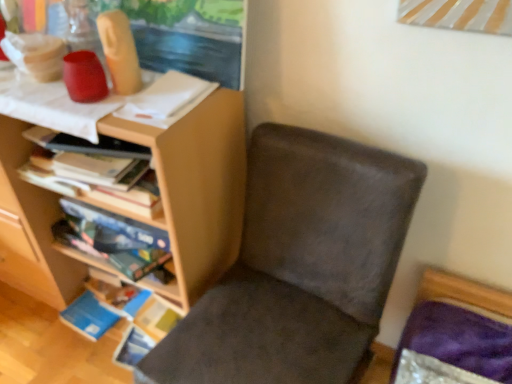
The image size is (512, 384). What do you see at coordinates (133, 211) in the screenshot?
I see `matte wood shelf at upper left, which is counted as the second shelf, starting from the bottom` at bounding box center [133, 211].

What is the approximate width of suede-like brown chair at center?

21.04 inches.

The height and width of the screenshot is (384, 512). I want to click on wooden bookshelf at left, which ranks as the 2th shelf in top-to-bottom order, so [31, 228].

Choose the correct answer: Is matte wood shelf at upper left, which ranks as the first shelf in top-to-bottom order, inside wooden bookshelf at left, the first shelf from the bottom, or outside it?

matte wood shelf at upper left, which ranks as the first shelf in top-to-bottom order, is outside wooden bookshelf at left, the first shelf from the bottom.

Based on the photo, is matte wood shelf at upper left, which is counted as the second shelf, starting from the bottom, far away from wooden bookshelf at left, which ranks as the 2th shelf in top-to-bottom order?

matte wood shelf at upper left, which is counted as the second shelf, starting from the bottom, is near wooden bookshelf at left, which ranks as the 2th shelf in top-to-bottom order, not far away.

From their relative heights in the image, would you say matte wood shelf at upper left, which is counted as the second shelf, starting from the bottom, is taller or shorter than wooden bookshelf at left, the first shelf from the bottom?

matte wood shelf at upper left, which is counted as the second shelf, starting from the bottom, is taller than wooden bookshelf at left, the first shelf from the bottom.

Which of these two, suede-like brown chair at center or wooden bookshelf at left, the first shelf from the bottom, is smaller?

Smaller between the two is wooden bookshelf at left, the first shelf from the bottom.

Is suede-like brown chair at center positioned with its back to wooden bookshelf at left, which ranks as the 2th shelf in top-to-bottom order?

No, suede-like brown chair at center is not facing the opposite direction of wooden bookshelf at left, which ranks as the 2th shelf in top-to-bottom order.

In the image, is suede-like brown chair at center on the left side or the right side of wooden bookshelf at left, which ranks as the 2th shelf in top-to-bottom order?

From the image, it's evident that suede-like brown chair at center is to the right of wooden bookshelf at left, which ranks as the 2th shelf in top-to-bottom order.

What's the angular difference between suede-like brown chair at center and wooden bookshelf at left, the first shelf from the bottom,'s facing directions?

The facing directions of suede-like brown chair at center and wooden bookshelf at left, the first shelf from the bottom, are 4.4 degrees apart.

From the image's perspective, who appears lower, suede-like brown chair at center or matte wood shelf at upper left, which ranks as the first shelf in top-to-bottom order?

suede-like brown chair at center is shown below in the image.

Does suede-like brown chair at center have a larger size compared to matte wood shelf at upper left, which ranks as the first shelf in top-to-bottom order?

Actually, suede-like brown chair at center might be smaller than matte wood shelf at upper left, which ranks as the first shelf in top-to-bottom order.

Between suede-like brown chair at center and matte wood shelf at upper left, which ranks as the first shelf in top-to-bottom order, which one appears on the left side from the viewer's perspective?

matte wood shelf at upper left, which ranks as the first shelf in top-to-bottom order.

What's the angular difference between wooden bookshelf at left, which ranks as the 2th shelf in top-to-bottom order, and suede-like brown chair at center's facing directions?

The angular difference between wooden bookshelf at left, which ranks as the 2th shelf in top-to-bottom order, and suede-like brown chair at center is 4.4 degrees.

Considering the positions of points (16, 179) and (174, 335), is point (16, 179) farther from camera compared to point (174, 335)?

That is True.

This screenshot has width=512, height=384. Find the location of `the 1st shelf to the left of the suede-like brown chair at center, starting your count from the anchor`. the 1st shelf to the left of the suede-like brown chair at center, starting your count from the anchor is located at coordinates (31, 228).

Would you consider wooden bookshelf at left, the first shelf from the bottom, to be distant from suede-like brown chair at center?

wooden bookshelf at left, the first shelf from the bottom, is actually quite close to suede-like brown chair at center.

Is the depth of matte wood shelf at upper left, which is counted as the second shelf, starting from the bottom, less than that of suede-like brown chair at center?

No, matte wood shelf at upper left, which is counted as the second shelf, starting from the bottom, is behind suede-like brown chair at center.

Is matte wood shelf at upper left, which ranks as the first shelf in top-to-bottom order, facing towards suede-like brown chair at center?

No, matte wood shelf at upper left, which ranks as the first shelf in top-to-bottom order, is not aimed at suede-like brown chair at center.

Looking at this image, which of these two, matte wood shelf at upper left, which ranks as the first shelf in top-to-bottom order, or suede-like brown chair at center, is smaller?

suede-like brown chair at center.

Visually, is wooden bookshelf at left, the first shelf from the bottom, positioned to the left or to the right of matte wood shelf at upper left, which is counted as the second shelf, starting from the bottom?

wooden bookshelf at left, the first shelf from the bottom, is to the right of matte wood shelf at upper left, which is counted as the second shelf, starting from the bottom.

Measure the distance from wooden bookshelf at left, the first shelf from the bottom, to matte wood shelf at upper left, which ranks as the first shelf in top-to-bottom order.

wooden bookshelf at left, the first shelf from the bottom, is 6.46 inches from matte wood shelf at upper left, which ranks as the first shelf in top-to-bottom order.

Does wooden bookshelf at left, which ranks as the 2th shelf in top-to-bottom order, touch matte wood shelf at upper left, which is counted as the second shelf, starting from the bottom?

No, wooden bookshelf at left, which ranks as the 2th shelf in top-to-bottom order, is not with matte wood shelf at upper left, which is counted as the second shelf, starting from the bottom.

Does wooden bookshelf at left, which ranks as the 2th shelf in top-to-bottom order, come in front of matte wood shelf at upper left, which ranks as the first shelf in top-to-bottom order?

No, it is behind matte wood shelf at upper left, which ranks as the first shelf in top-to-bottom order.

Locate an element on the screen. The width and height of the screenshot is (512, 384). shelf above the wooden bookshelf at left, which ranks as the 2th shelf in top-to-bottom order (from the image's perspective) is located at coordinates (133, 211).

Identify the location of chair that is on the right side of wooden bookshelf at left, the first shelf from the bottom. This screenshot has width=512, height=384. (298, 266).

Which object lies nearer to the anchor point suede-like brown chair at center, wooden bookshelf at left, the first shelf from the bottom, or matte wood shelf at upper left, which is counted as the second shelf, starting from the bottom?

matte wood shelf at upper left, which is counted as the second shelf, starting from the bottom, lies closer to suede-like brown chair at center than the other object.

Considering their positions, is matte wood shelf at upper left, which is counted as the second shelf, starting from the bottom, positioned further to wooden bookshelf at left, the first shelf from the bottom, than suede-like brown chair at center?

suede-like brown chair at center is positioned further to the anchor wooden bookshelf at left, the first shelf from the bottom.

When comparing their distances from wooden bookshelf at left, which ranks as the 2th shelf in top-to-bottom order, does suede-like brown chair at center or matte wood shelf at upper left, which is counted as the second shelf, starting from the bottom, seem closer?

Among the two, matte wood shelf at upper left, which is counted as the second shelf, starting from the bottom, is located nearer to wooden bookshelf at left, which ranks as the 2th shelf in top-to-bottom order.

When comparing their distances from matte wood shelf at upper left, which ranks as the first shelf in top-to-bottom order, does wooden bookshelf at left, the first shelf from the bottom, or suede-like brown chair at center seem closer?

Based on the image, wooden bookshelf at left, the first shelf from the bottom, appears to be nearer to matte wood shelf at upper left, which ranks as the first shelf in top-to-bottom order.

From the image, which object appears to be farther from matte wood shelf at upper left, which is counted as the second shelf, starting from the bottom, suede-like brown chair at center or wooden bookshelf at left, which ranks as the 2th shelf in top-to-bottom order?

Based on the image, suede-like brown chair at center appears to be further to matte wood shelf at upper left, which is counted as the second shelf, starting from the bottom.

From the image, which object appears to be farther from suede-like brown chair at center, matte wood shelf at upper left, which is counted as the second shelf, starting from the bottom, or wooden bookshelf at left, which ranks as the 2th shelf in top-to-bottom order?

Among the two, wooden bookshelf at left, which ranks as the 2th shelf in top-to-bottom order, is located further to suede-like brown chair at center.

Locate an element on the screen. The width and height of the screenshot is (512, 384). shelf between matte wood shelf at upper left, which is counted as the second shelf, starting from the bottom, and suede-like brown chair at center, in the horizontal direction is located at coordinates (31, 228).